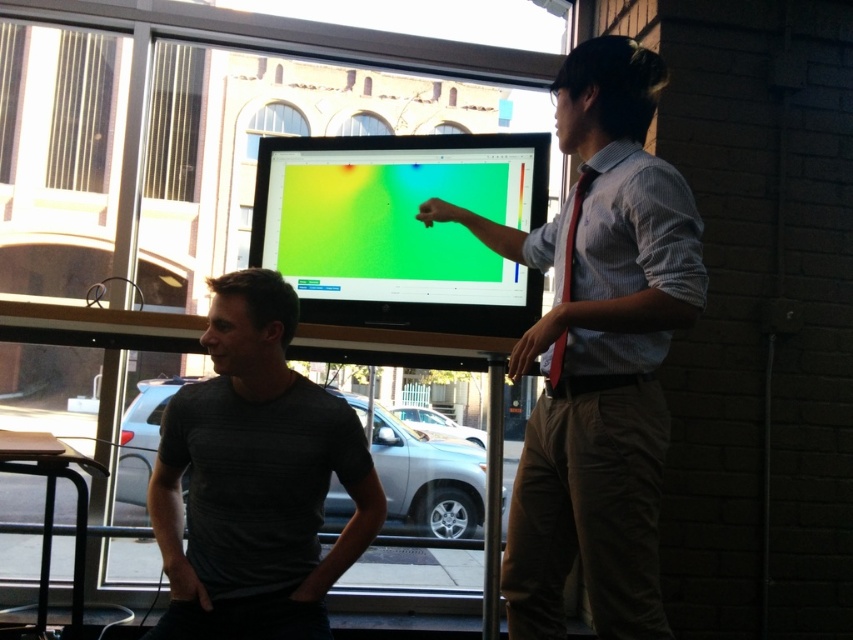
You are organizing a presentation and need to choose between two shirts for a formal event. The light brown cotton shirt at center and the gray textured shirt at center are your options. Based on their thickness, which shirt would be more comfortable for a long presentation?

The light brown cotton shirt at center is thinner than the gray textured shirt at center, so it would be more comfortable for a long presentation due to its lighter material.

You are standing in the presentation room and need to determine which of the two points, point (607, 188) or point (321, 472), is nearer to you. Based on the scene description, which point is closer?

Point (607, 188) is closer to the viewer than point (321, 472).

You are standing at the point marked as point (x=305, y=604) in the presentation room. You need to walk to the nearest exit, which is located behind the screen. Can you reach it without passing through the seated person?

The distance between you and the seated person is 5.57 feet, so yes, you can reach the exit behind the screen without passing through them as there is enough space.